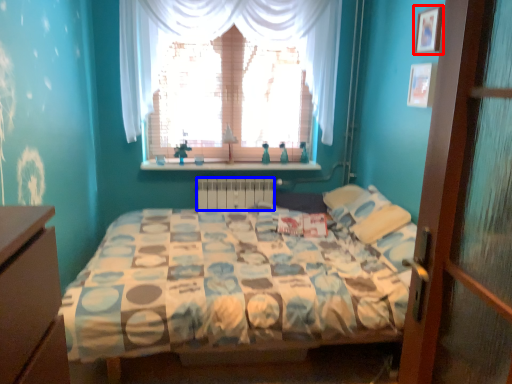
Question: Which of the following is the farthest to the observer, picture frame (highlighted by a red box) or radiator (highlighted by a blue box)?

Choices:
 (A) picture frame
 (B) radiator

Answer: (B)